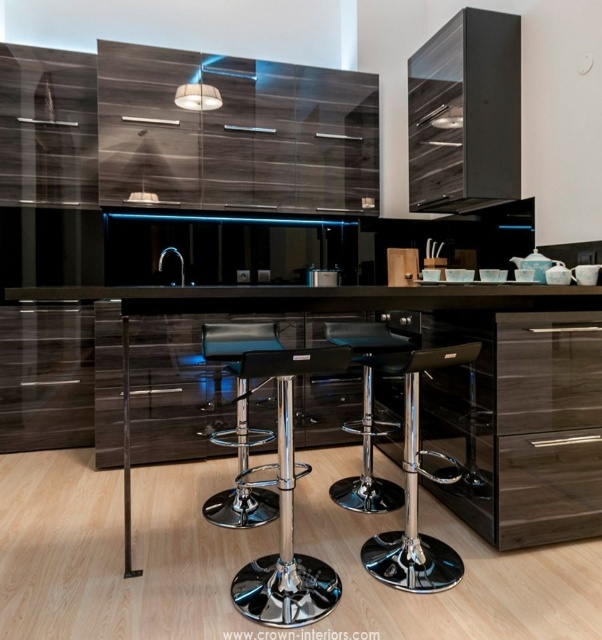
Can you confirm if chrome/black bar stool at center is smaller than black leather bar stool at center?

Yes, chrome/black bar stool at center is smaller than black leather bar stool at center.

Describe the element at coordinates (287, 506) in the screenshot. I see `chrome/black bar stool at center` at that location.

This screenshot has height=640, width=602. Identify the location of chrome/black bar stool at center. (287, 506).

Identify the location of chrome/black bar stool at center. The image size is (602, 640). (287, 506).

Does black glossy counter top at center lie behind polished chrome bar stool at center?

No, black glossy counter top at center is closer to the viewer.

Identify the location of black glossy counter top at center. The image size is (602, 640). (326, 298).

Does chrome/black bar stool at center come behind black chrome bar stool at center?

No, chrome/black bar stool at center is closer to the viewer.

Can you confirm if chrome/black bar stool at center is positioned to the left of black chrome bar stool at center?

No, chrome/black bar stool at center is not to the left of black chrome bar stool at center.

The image size is (602, 640). What do you see at coordinates (287, 506) in the screenshot?
I see `chrome/black bar stool at center` at bounding box center [287, 506].

This screenshot has height=640, width=602. Find the location of `chrome/black bar stool at center`. chrome/black bar stool at center is located at coordinates (287, 506).